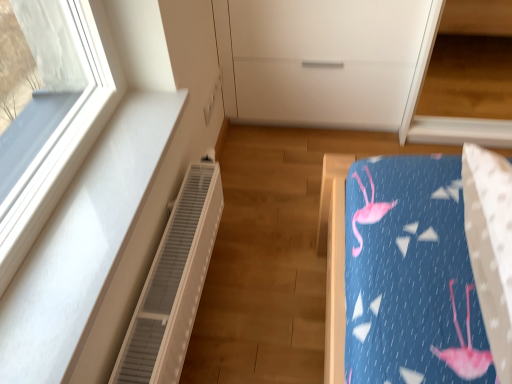
Question: Is white plastic radiator at left taller than white matte dresser at upper center?

Choices:
 (A) no
 (B) yes

Answer: (A)

Question: Is white plastic radiator at left not inside white matte dresser at upper center?

Choices:
 (A) yes
 (B) no

Answer: (A)

Question: Is white plastic radiator at left at the right side of white matte dresser at upper center?

Choices:
 (A) no
 (B) yes

Answer: (A)

Question: Is white plastic radiator at left placed right next to white matte dresser at upper center?

Choices:
 (A) no
 (B) yes

Answer: (A)

Question: From the image's perspective, does white plastic radiator at left appear higher than white matte dresser at upper center?

Choices:
 (A) yes
 (B) no

Answer: (B)

Question: Is white matte dresser at upper center inside white plastic radiator at left?

Choices:
 (A) yes
 (B) no

Answer: (B)

Question: Is white matte dresser at upper center completely or partially outside of white plastic radiator at left?

Choices:
 (A) yes
 (B) no

Answer: (A)

Question: Considering the relative sizes of white matte dresser at upper center and white plastic radiator at left in the image provided, is white matte dresser at upper center thinner than white plastic radiator at left?

Choices:
 (A) no
 (B) yes

Answer: (A)

Question: Is white matte dresser at upper center in contact with white plastic radiator at left?

Choices:
 (A) yes
 (B) no

Answer: (B)

Question: Is white matte dresser at upper center closer to camera compared to white plastic radiator at left?

Choices:
 (A) no
 (B) yes

Answer: (A)

Question: Is white matte dresser at upper center oriented away from white plastic radiator at left?

Choices:
 (A) no
 (B) yes

Answer: (A)

Question: Is white matte dresser at upper center at the right side of white plastic radiator at left?

Choices:
 (A) yes
 (B) no

Answer: (A)

Question: Considering their positions, is white plastic radiator at left located in front of or behind white matte dresser at upper center?

Choices:
 (A) behind
 (B) front

Answer: (B)